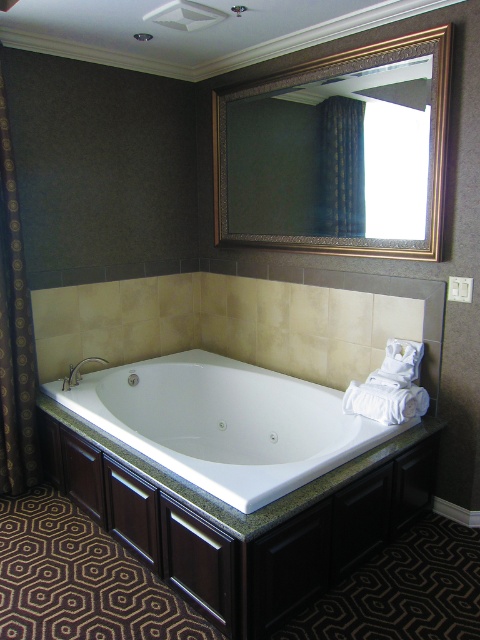
You are standing in the luxurious bathroom and want to adjust the dark brown textured curtain at left. To reach it, you need to pass in front of the gold textured mirror at upper center. Is the curtain behind the mirror or in front of it?

The gold textured mirror at upper center is closer to the viewer than the dark brown textured curtain at left, so the curtain is behind the mirror.

You are designing a bathroom layout and need to ensure that the gold textured mirror at upper center and the matte silver faucet at lower left are visible from the main entrance. Given their positions, which object will appear higher in the bathroom?

The gold textured mirror at upper center is taller than the matte silver faucet at lower left, so it will appear higher in the bathroom.